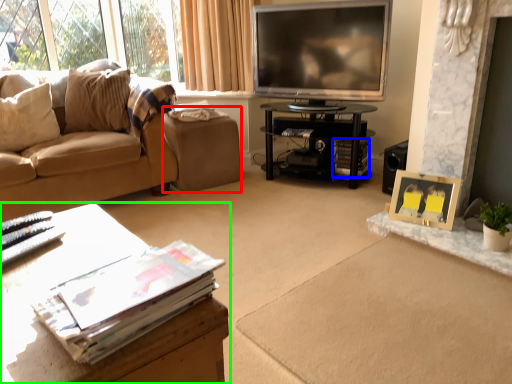
Question: Considering the real-world distances, which object is farthest from footrest (highlighted by a red box)? magazine (highlighted by a blue box) or table (highlighted by a green box)?

Choices:
 (A) magazine
 (B) table

Answer: (B)